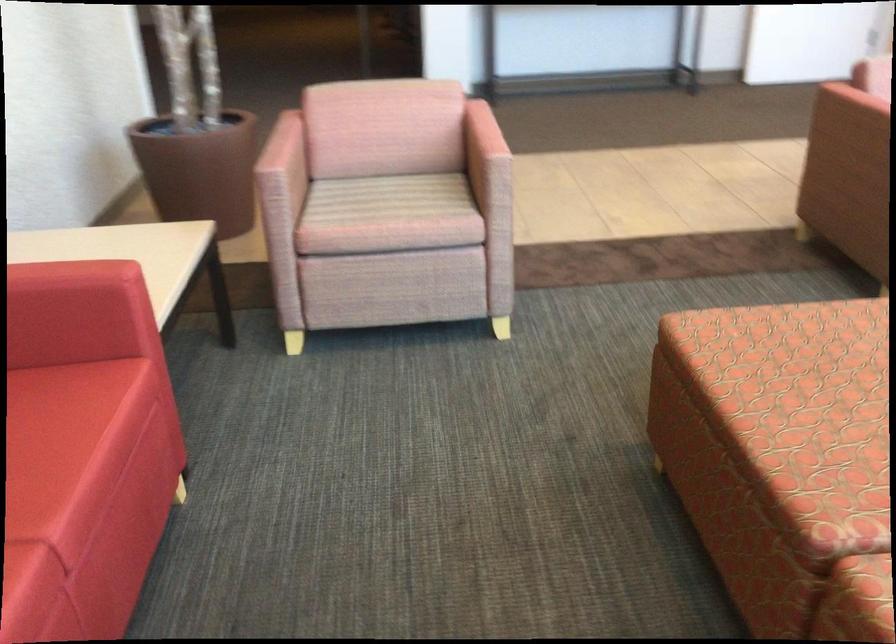
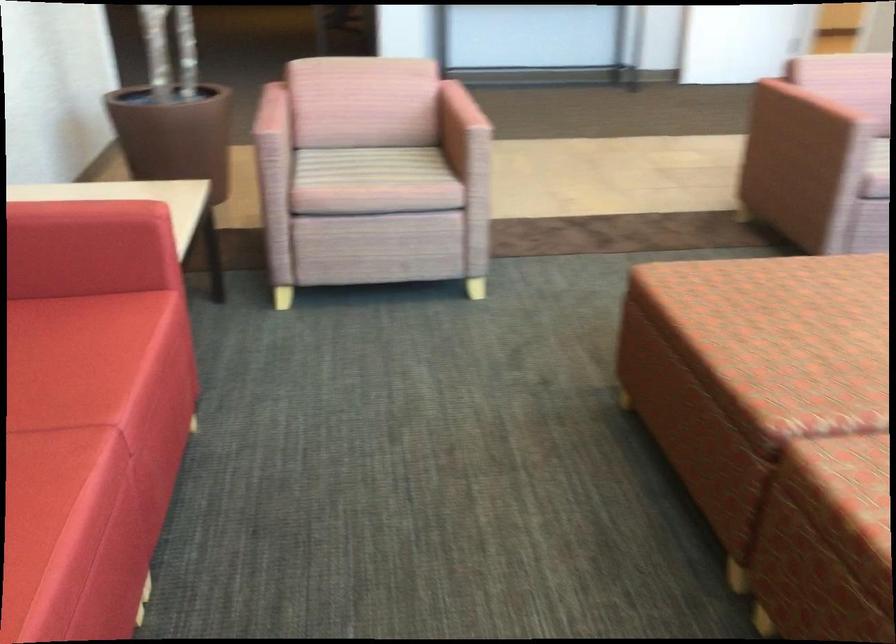
Question: I am providing you with two images of the same scene from different viewpoints. After the viewpoint changes to image2, which objects are now occluded?

Choices:
 (A) patterned sofa sitting surface
 (B) red sofa sitting surface
 (C) red sofa armrest
 (D) none of these

Answer: (D)